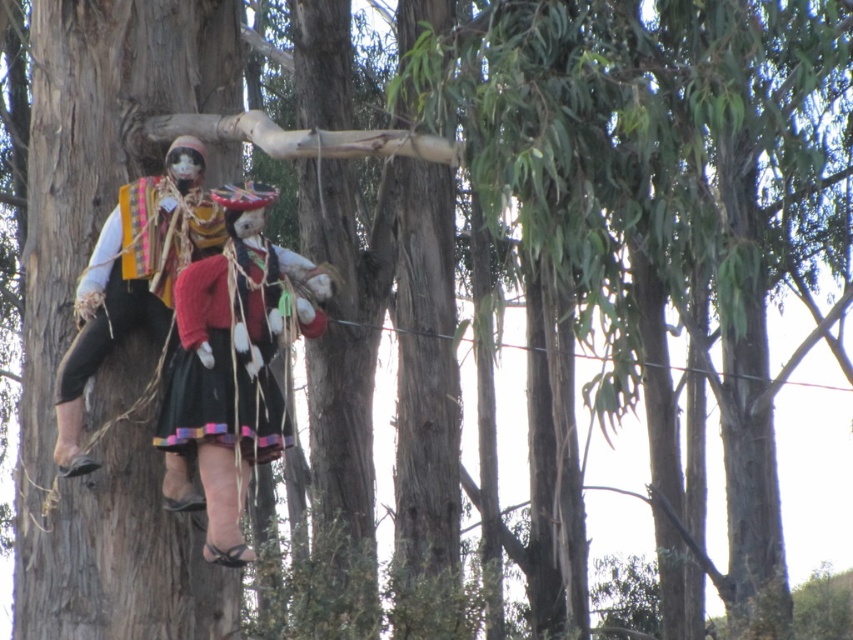
Question: Is matte black dress at center wider than textured fabric doll at center?

Choices:
 (A) no
 (B) yes

Answer: (A)

Question: Does matte black dress at center appear under textured fabric doll at center?

Choices:
 (A) yes
 (B) no

Answer: (A)

Question: Does matte black dress at center appear over textured fabric doll at center?

Choices:
 (A) yes
 (B) no

Answer: (B)

Question: Among these objects, which one is nearest to the camera?

Choices:
 (A) matte black dress at center
 (B) textured fabric doll at center

Answer: (A)

Question: Which point is closer to the camera?

Choices:
 (A) (231, 324)
 (B) (74, 360)

Answer: (A)